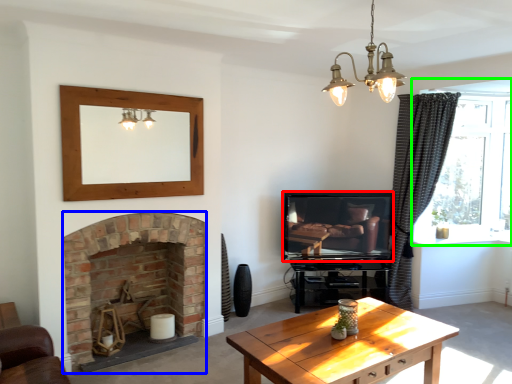
Question: Which object is the farthest from television (highlighted by a red box)? Choose among these: fireplace (highlighted by a blue box) or window (highlighted by a green box).

Choices:
 (A) fireplace
 (B) window

Answer: (A)